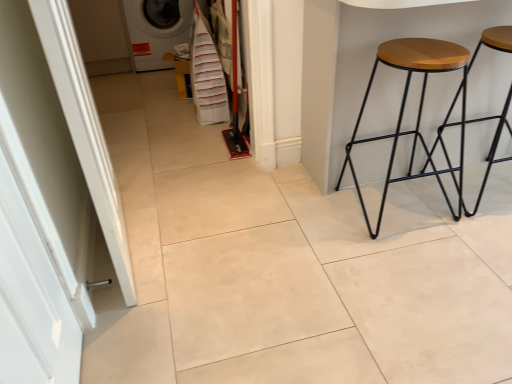
Locate an element on the screen. The width and height of the screenshot is (512, 384). unoccupied area in front of wooden seat stool at right, which appears as the second stool when viewed from the left is located at coordinates (479, 238).